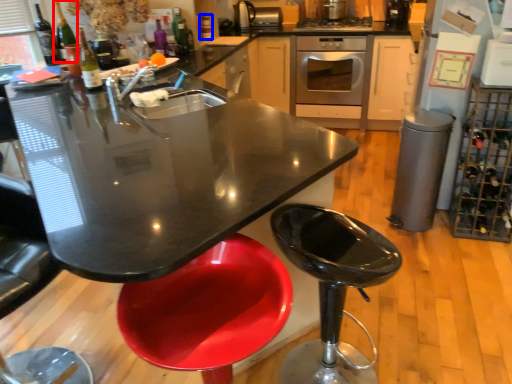
Question: Among these objects, which one is farthest to the camera, wine bottle (highlighted by a red box) or bottle (highlighted by a blue box)?

Choices:
 (A) wine bottle
 (B) bottle

Answer: (B)